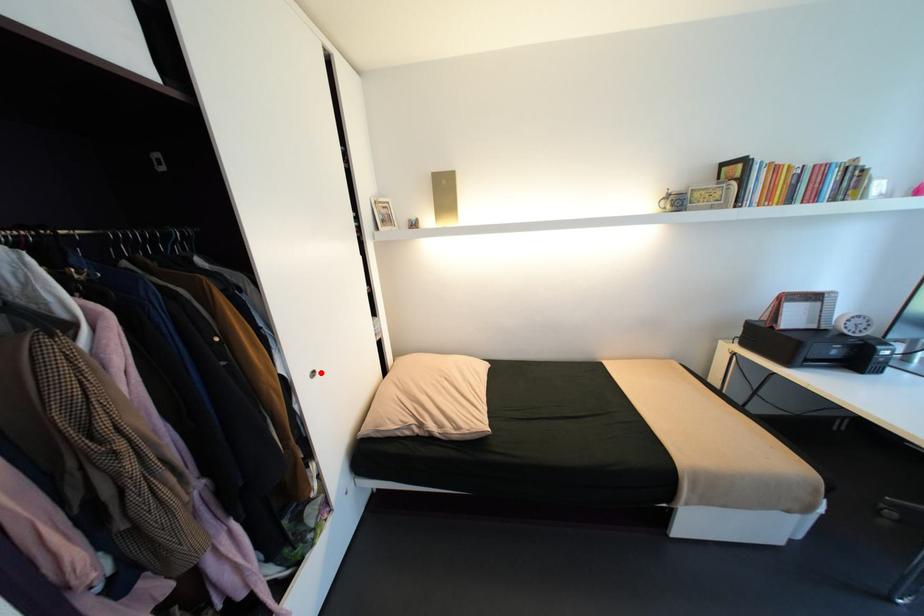
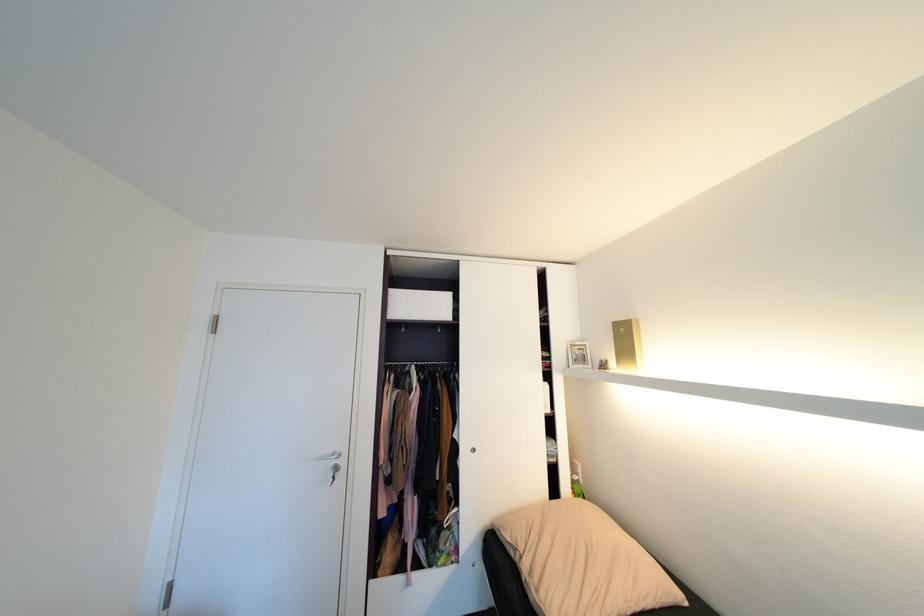
Question: I am providing you with two images of the same scene from different viewpoints. A red point is marked on the first image. At the location where the point appears in image 1, is it still visible in image 2?

Choices:
 (A) Yes
 (B) No

Answer: (A)